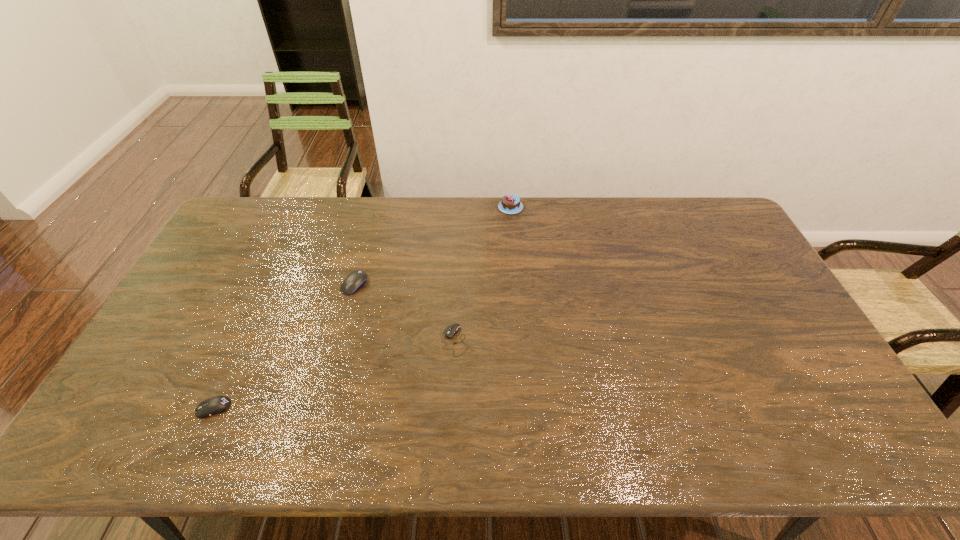
Identify the location of free area in between the rightmost computer mouse and the leftmost computer mouse. The image size is (960, 540). (334, 374).

At what (x,y) coordinates should I click in order to perform the action: click on empty space that is in between the shortest computer mouse and the third shortest object. Please return your answer as a coordinate pair (x, y). The width and height of the screenshot is (960, 540). Looking at the image, I should click on (405, 313).

Where is `vacant space that is in between the leftmost computer mouse and the third object from left to right`? The height and width of the screenshot is (540, 960). vacant space that is in between the leftmost computer mouse and the third object from left to right is located at coordinates (334, 374).

You are a GUI agent. You are given a task and a screenshot of the screen. Output one action in this format:
    pyautogui.click(x=<x>, y=<y>)
    Task: Click on the vacant space that is in between the chocolate cake and the leftmost object
    This screenshot has height=540, width=960.
    Given the screenshot: What is the action you would take?
    pyautogui.click(x=362, y=308)

The height and width of the screenshot is (540, 960). Identify the location of vacant space in between the farthest computer mouse and the second object from right to left. (405, 313).

Where is `free point between the third nearest object and the nearest object`? This screenshot has height=540, width=960. free point between the third nearest object and the nearest object is located at coordinates (284, 346).

The height and width of the screenshot is (540, 960). Find the location of `free space between the third object from right to left and the second shortest computer mouse`. free space between the third object from right to left and the second shortest computer mouse is located at coordinates (284, 346).

Find the location of a particular element. This screenshot has width=960, height=540. the third closest object to the second object from left to right is located at coordinates (510, 204).

Locate an element on the screen. The width and height of the screenshot is (960, 540). object that stands as the closest to the rightmost computer mouse is located at coordinates (355, 280).

Find the location of `computer mouse that is the second closest one to the second shortest computer mouse`. computer mouse that is the second closest one to the second shortest computer mouse is located at coordinates (450, 331).